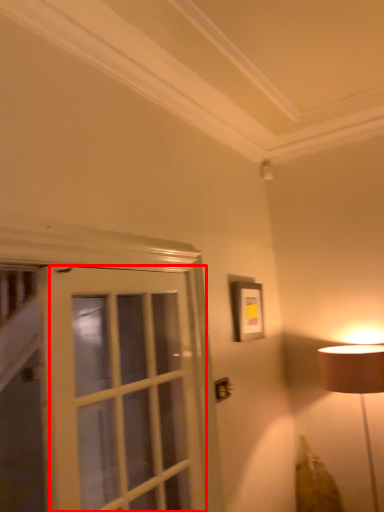
Question: From the image's perspective, where is screen door (annotated by the red box) located relative to picture frame?

Choices:
 (A) below
 (B) above

Answer: (A)